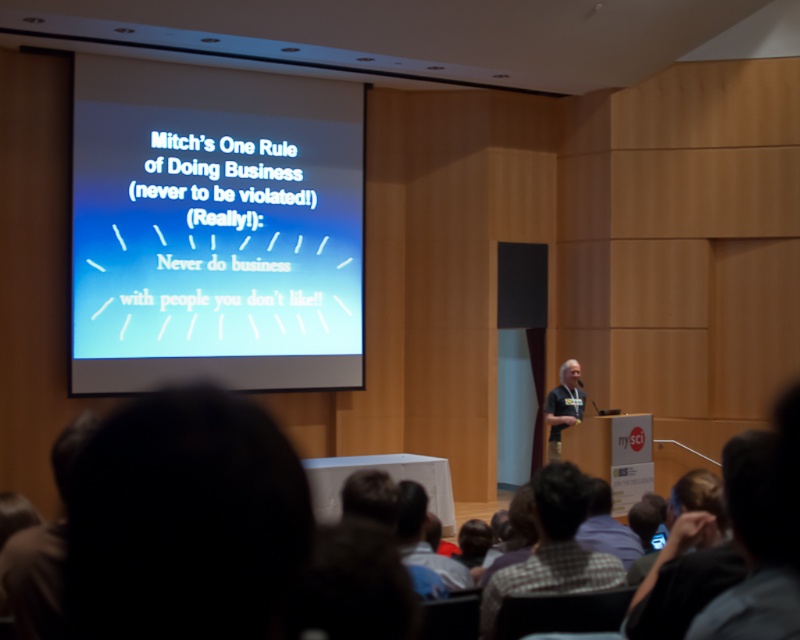
Is checkered shirt at lower center shorter than dark gray shirt at center?

Yes.

Which is in front, point (586, 508) or point (560, 435)?

Point (586, 508) is more forward.

The width and height of the screenshot is (800, 640). I want to click on checkered shirt at lower center, so click(x=552, y=547).

How much distance is there between white matte projector screen at upper center and checkered shirt at lower center?

They are 6.62 meters apart.

Can you confirm if white matte projector screen at upper center is bigger than checkered shirt at lower center?

Yes, white matte projector screen at upper center is bigger than checkered shirt at lower center.

Between point (356, 371) and point (594, 566), which one is positioned in front?

Point (594, 566)

The height and width of the screenshot is (640, 800). What are the coordinates of `white matte projector screen at upper center` in the screenshot? It's located at (214, 228).

Does white matte projector screen at upper center have a smaller size compared to dark gray shirt at center?

No, white matte projector screen at upper center is not smaller than dark gray shirt at center.

What do you see at coordinates (214, 228) in the screenshot? This screenshot has height=640, width=800. I see `white matte projector screen at upper center` at bounding box center [214, 228].

What do you see at coordinates (214, 228) in the screenshot?
I see `white matte projector screen at upper center` at bounding box center [214, 228].

The width and height of the screenshot is (800, 640). Find the location of `white matte projector screen at upper center`. white matte projector screen at upper center is located at coordinates (214, 228).